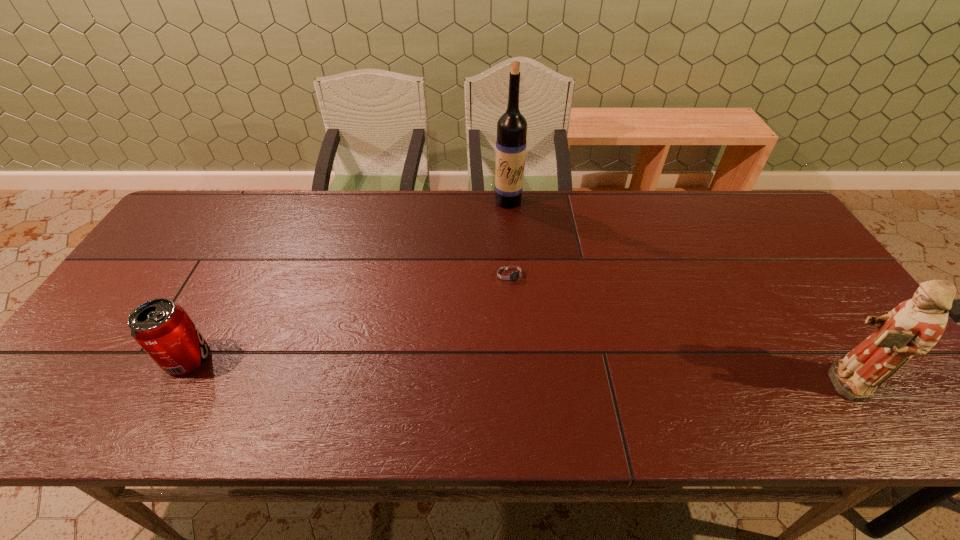
Identify the location of vacant space located 0.130m on the front-facing side of the rightmost object. The image size is (960, 540). (757, 382).

Find the location of `free location located 0.360m on the front-facing side of the rightmost object`. free location located 0.360m on the front-facing side of the rightmost object is located at coordinates (655, 382).

At what (x,y) coordinates should I click in order to perform the action: click on vacant space situated on the face of the watch. Please return your answer as a coordinate pair (x, y). Looking at the image, I should click on click(x=534, y=308).

The width and height of the screenshot is (960, 540). In order to click on blank space located on the face of the watch in this screenshot , I will do coord(582,381).

This screenshot has height=540, width=960. Find the location of `vacant point located 0.230m on the face of the watch`. vacant point located 0.230m on the face of the watch is located at coordinates (565, 356).

Identify the location of vacant space located on the label of the farthest object. (494, 249).

I want to click on vacant space located 0.330m on the label of the farthest object, so click(485, 281).

Find the location of a particular element. The width and height of the screenshot is (960, 540). blank space located on the label of the farthest object is located at coordinates (492, 259).

Where is `object that is at the far edge`? object that is at the far edge is located at coordinates (511, 142).

Where is `soda can that is at the near edge`? The width and height of the screenshot is (960, 540). soda can that is at the near edge is located at coordinates (162, 328).